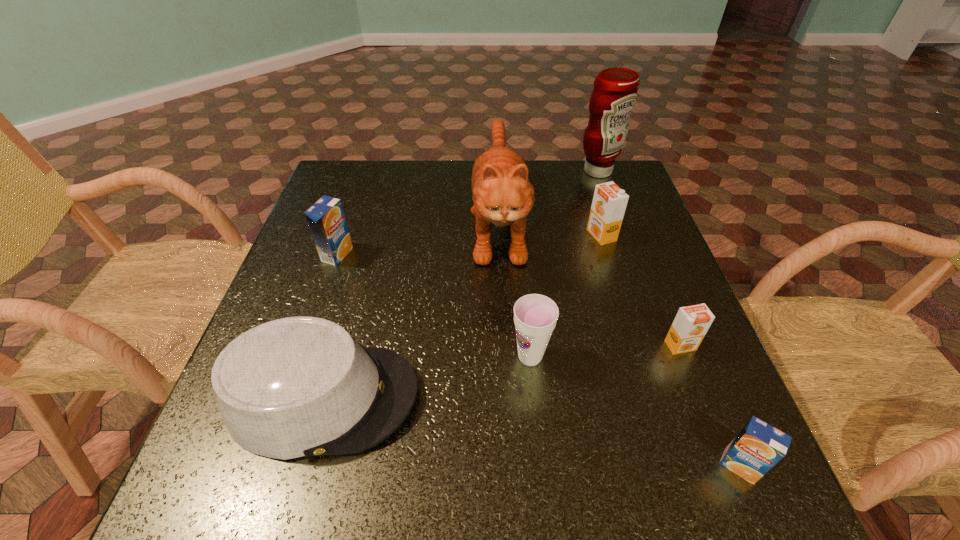
Where is `free space in the image that satisfies the following two spatial constraints: 1. on the face of the orange cat; 2. on the left side of the cup`? free space in the image that satisfies the following two spatial constraints: 1. on the face of the orange cat; 2. on the left side of the cup is located at coordinates (505, 357).

You are a GUI agent. You are given a task and a screenshot of the screen. Output one action in this format:
    pyautogui.click(x=<x>, y=<y>)
    Task: Click on the free space that satisfies the following two spatial constraints: 1. on the face of the cat; 2. on the front-facing side of the hat
    The height and width of the screenshot is (540, 960).
    Given the screenshot: What is the action you would take?
    pyautogui.click(x=507, y=397)